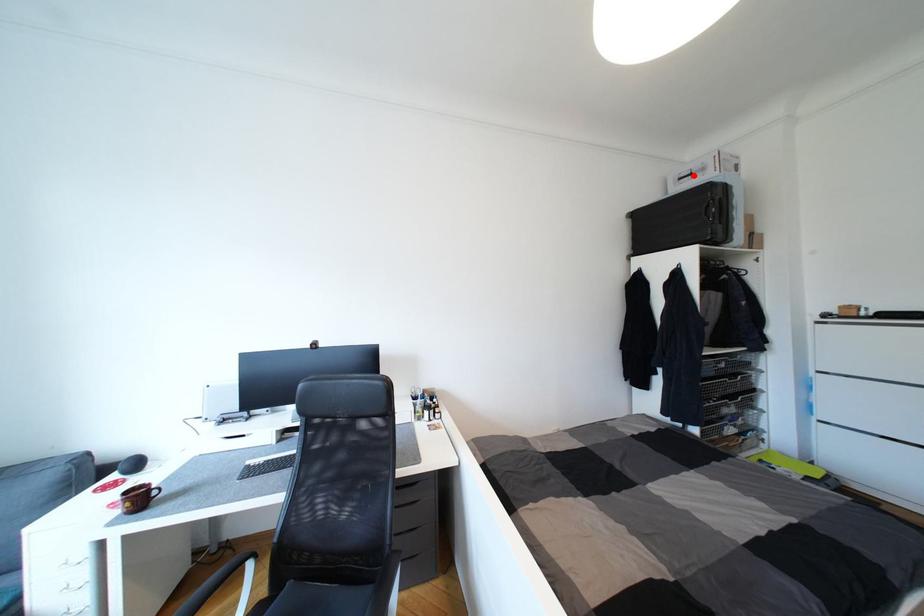
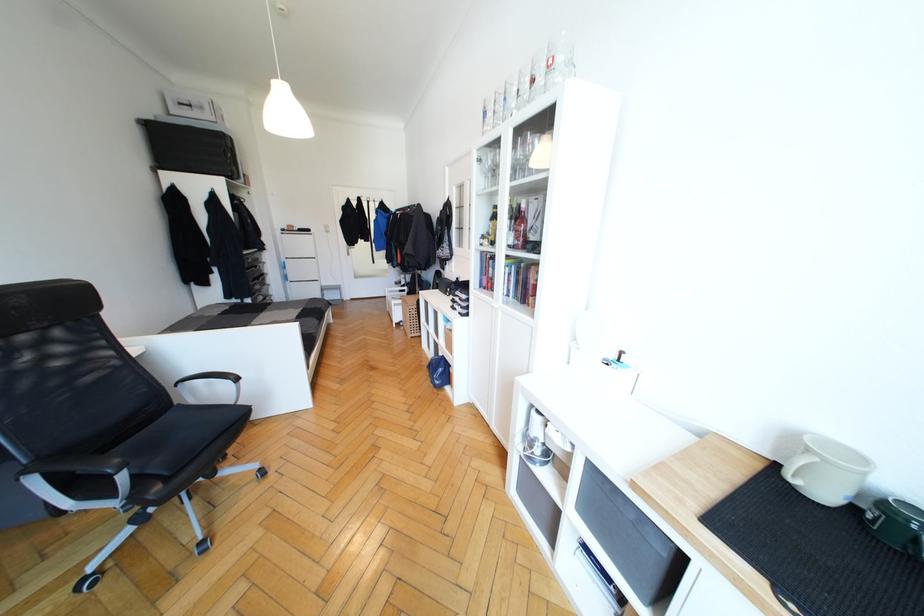
In the second image, find the point that corresponds to the highlighted location in the first image.

(193, 108)